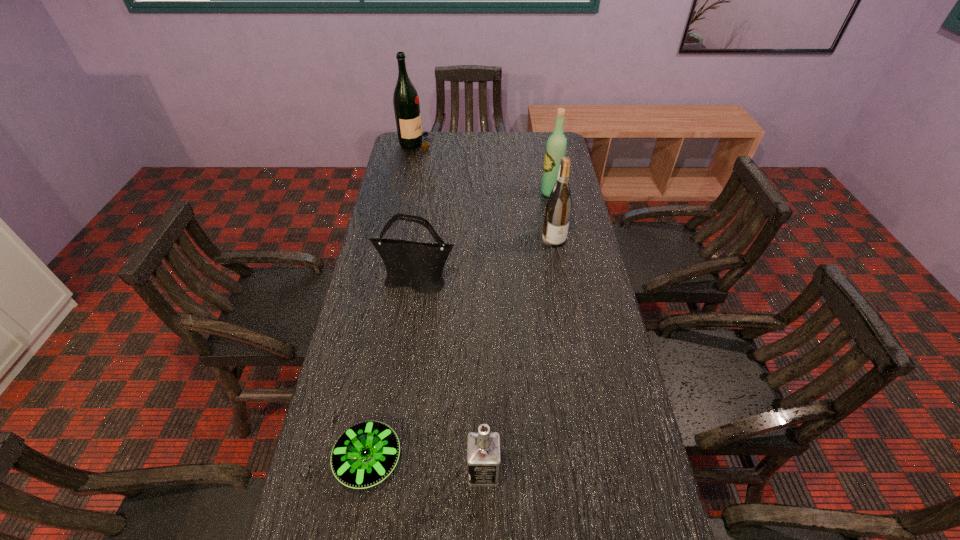
You are a GUI agent. You are given a task and a screenshot of the screen. Output one action in this format:
    pyautogui.click(x=<x>, y=<y>)
    Task: Click on the farthest wine bottle
    The height and width of the screenshot is (540, 960).
    Given the screenshot: What is the action you would take?
    pyautogui.click(x=405, y=99)

Find the location of a particular element. the farthest object is located at coordinates (405, 99).

Locate an element on the screen. The height and width of the screenshot is (540, 960). the second farthest object is located at coordinates (556, 146).

Find the location of a particular element. the nearest wine bottle is located at coordinates (558, 209).

You are a GUI agent. You are given a task and a screenshot of the screen. Output one action in this format:
    pyautogui.click(x=<x>, y=<y>)
    Task: Click on the shoulder bag
    
    Given the screenshot: What is the action you would take?
    pyautogui.click(x=419, y=266)

I want to click on the third shortest object, so click(419, 266).

The image size is (960, 540). What are the coordinates of `the fifth tallest object` in the screenshot? It's located at (483, 447).

At what (x,y) coordinates should I click in order to perform the action: click on the third object from right to left. Please return your answer as a coordinate pair (x, y). Image resolution: width=960 pixels, height=540 pixels. Looking at the image, I should click on (483, 447).

Where is `saucer`? saucer is located at coordinates (364, 455).

You are a GUI agent. You are given a task and a screenshot of the screen. Output one action in this format:
    pyautogui.click(x=<x>, y=<y>)
    Task: Click on the vacant space positioned 0.190m on the surface of the farthest object
    
    Given the screenshot: What is the action you would take?
    pyautogui.click(x=475, y=144)